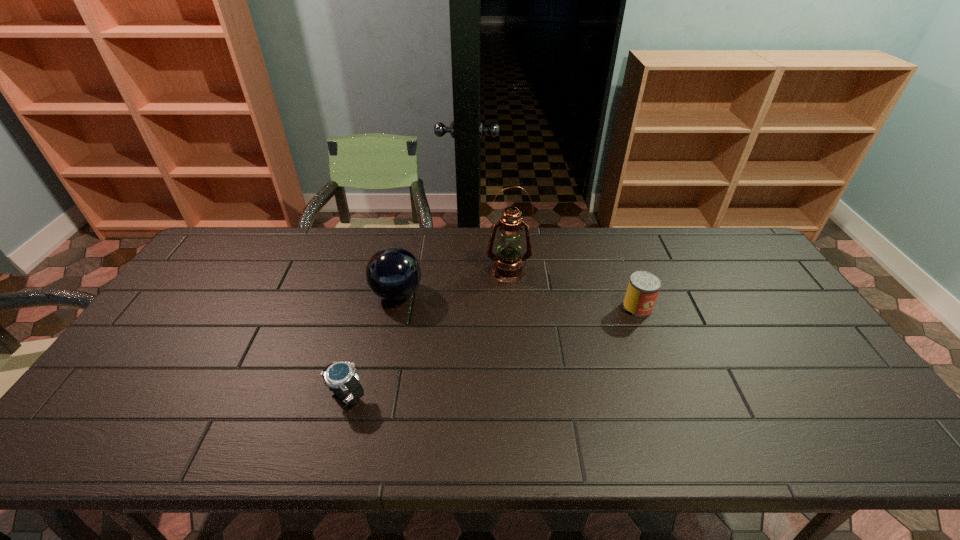
In order to click on free point between the third object from left to right and the watch in this screenshot , I will do `click(427, 333)`.

Where is `vacant area that lies between the watch and the third shortest object`? The width and height of the screenshot is (960, 540). vacant area that lies between the watch and the third shortest object is located at coordinates (372, 345).

This screenshot has height=540, width=960. Find the location of `free point between the second object from right to left and the can`. free point between the second object from right to left and the can is located at coordinates (573, 289).

You are a GUI agent. You are given a task and a screenshot of the screen. Output one action in this format:
    pyautogui.click(x=<x>, y=<y>)
    Task: Click on the free space between the third shortest object and the watch
    The height and width of the screenshot is (540, 960).
    Given the screenshot: What is the action you would take?
    pyautogui.click(x=372, y=345)

Locate an element on the screen. This screenshot has width=960, height=540. vacant area that lies between the watch and the can is located at coordinates (492, 352).

You are a GUI agent. You are given a task and a screenshot of the screen. Output one action in this format:
    pyautogui.click(x=<x>, y=<y>)
    Task: Click on the vacant point located between the can and the bowling ball
    The height and width of the screenshot is (540, 960).
    Given the screenshot: What is the action you would take?
    pyautogui.click(x=517, y=301)

You are a GUI agent. You are given a task and a screenshot of the screen. Output one action in this format:
    pyautogui.click(x=<x>, y=<y>)
    Task: Click on the object that is the second closest to the can
    Image resolution: width=960 pixels, height=540 pixels.
    Given the screenshot: What is the action you would take?
    pyautogui.click(x=393, y=273)

Choose which object is the second nearest neighbor to the can. Please provide its 2D coordinates. Your answer should be formatted as a tuple, i.e. [(x, y)], where the tuple contains the x and y coordinates of a point satisfying the conditions above.

[(393, 273)]

This screenshot has width=960, height=540. I want to click on vacant point that satisfies the following two spatial constraints: 1. on the front side of the tallest object; 2. on the side of the bowling ball with the finger holes, so click(511, 294).

Identify the location of free space that satisfies the following two spatial constraints: 1. on the front side of the oil lamp; 2. on the side of the bowling ball with the finger holes. (511, 294).